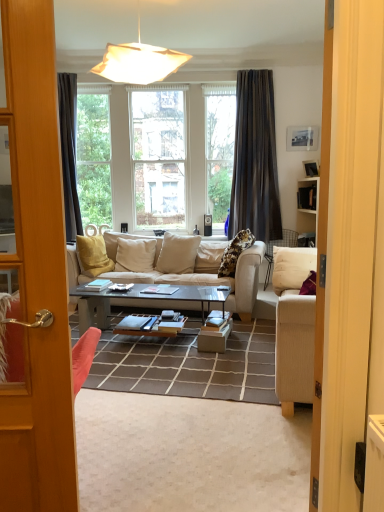
Question: From the image's perspective, is beige fabric couch at center over shiny black glass coffee table at center?

Choices:
 (A) no
 (B) yes

Answer: (B)

Question: Is there a large distance between beige fabric couch at center and shiny black glass coffee table at center?

Choices:
 (A) yes
 (B) no

Answer: (B)

Question: Is beige fabric couch at center positioned beyond the bounds of shiny black glass coffee table at center?

Choices:
 (A) no
 (B) yes

Answer: (B)

Question: Is beige fabric couch at center at the left side of shiny black glass coffee table at center?

Choices:
 (A) yes
 (B) no

Answer: (B)

Question: Considering the relative sizes of beige fabric couch at center and shiny black glass coffee table at center in the image provided, is beige fabric couch at center smaller than shiny black glass coffee table at center?

Choices:
 (A) no
 (B) yes

Answer: (A)

Question: In the image, is dark gray fabric curtain at upper center on the left side or the right side of shiny black glass coffee table at center?

Choices:
 (A) left
 (B) right

Answer: (B)

Question: From the image's perspective, is dark gray fabric curtain at upper center located above or below shiny black glass coffee table at center?

Choices:
 (A) below
 (B) above

Answer: (B)

Question: From their relative heights in the image, would you say dark gray fabric curtain at upper center is taller or shorter than shiny black glass coffee table at center?

Choices:
 (A) tall
 (B) short

Answer: (A)

Question: Does point (273, 112) appear closer or farther from the camera than point (218, 297)?

Choices:
 (A) closer
 (B) farther

Answer: (B)

Question: Is point (158, 54) positioned closer to the camera than point (273, 236)?

Choices:
 (A) closer
 (B) farther

Answer: (A)

Question: Would you say matte white pendant light at upper center is inside or outside dark gray fabric curtain at upper center?

Choices:
 (A) inside
 (B) outside

Answer: (B)

Question: From a real-world perspective, is matte white pendant light at upper center positioned above or below dark gray fabric curtain at upper center?

Choices:
 (A) below
 (B) above

Answer: (B)

Question: From their relative heights in the image, would you say matte white pendant light at upper center is taller or shorter than dark gray fabric curtain at upper center?

Choices:
 (A) tall
 (B) short

Answer: (B)

Question: Is matte white pendant light at upper center bigger or smaller than shiny black glass coffee table at center?

Choices:
 (A) small
 (B) big

Answer: (B)

Question: Is matte white pendant light at upper center in front of or behind shiny black glass coffee table at center in the image?

Choices:
 (A) behind
 (B) front

Answer: (B)